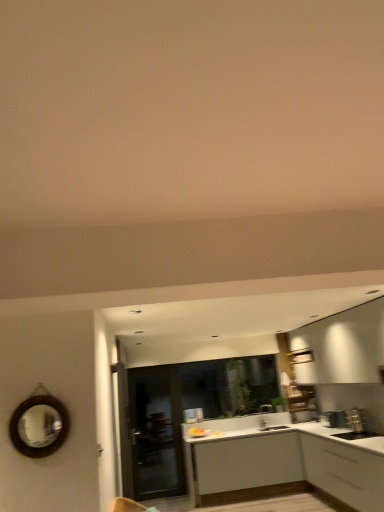
Question: Is silver metallic faucet at center to the left of white matte cabinet at lower right, marked as the 1th cabinetry in a front-to-back arrangement, from the viewer's perspective?

Choices:
 (A) no
 (B) yes

Answer: (B)

Question: Is silver metallic faucet at center in front of white matte cabinet at lower right, the 2th cabinetry positioned from the back?

Choices:
 (A) no
 (B) yes

Answer: (A)

Question: Considering the relative positions of silver metallic faucet at center and white matte cabinet at lower right, marked as the 1th cabinetry in a front-to-back arrangement, in the image provided, is silver metallic faucet at center to the right of white matte cabinet at lower right, marked as the 1th cabinetry in a front-to-back arrangement, from the viewer's perspective?

Choices:
 (A) yes
 (B) no

Answer: (B)

Question: Is silver metallic faucet at center turned away from white matte cabinet at lower right, the 2th cabinetry positioned from the back?

Choices:
 (A) no
 (B) yes

Answer: (A)

Question: Does silver metallic faucet at center have a larger size compared to white matte cabinet at lower right, the 2th cabinetry positioned from the back?

Choices:
 (A) no
 (B) yes

Answer: (A)

Question: Based on their sizes in the image, would you say transparent glass door at center is bigger or smaller than white matte cabinet at center, marked as the second cabinetry in a front-to-back arrangement?

Choices:
 (A) small
 (B) big

Answer: (A)

Question: From a real-world perspective, is transparent glass door at center positioned above or below white matte cabinet at center, the first cabinetry when ordered from back to front?

Choices:
 (A) below
 (B) above

Answer: (B)

Question: Is point (165, 472) positioned closer to the camera than point (291, 458)?

Choices:
 (A) farther
 (B) closer

Answer: (A)

Question: Considering their positions, is transparent glass door at center located in front of or behind white matte cabinet at center, marked as the second cabinetry in a front-to-back arrangement?

Choices:
 (A) behind
 (B) front

Answer: (A)

Question: Which is correct: brown wooden mirror at left is inside matte black door at center, or outside of it?

Choices:
 (A) outside
 (B) inside

Answer: (A)

Question: Visually, is brown wooden mirror at left positioned to the left or to the right of matte black door at center?

Choices:
 (A) right
 (B) left

Answer: (B)

Question: From a real-world perspective, is brown wooden mirror at left physically located above or below matte black door at center?

Choices:
 (A) above
 (B) below

Answer: (A)

Question: From the image's perspective, relative to matte black door at center, is brown wooden mirror at left above or below?

Choices:
 (A) below
 (B) above

Answer: (B)

Question: Is white matte cabinet at lower right, marked as the 1th cabinetry in a front-to-back arrangement, taller or shorter than white matte cabinet at center, marked as the second cabinetry in a front-to-back arrangement?

Choices:
 (A) tall
 (B) short

Answer: (B)

Question: From a real-world perspective, relative to white matte cabinet at center, the first cabinetry when ordered from back to front, is white matte cabinet at lower right, the 2th cabinetry positioned from the back, vertically above or below?

Choices:
 (A) below
 (B) above

Answer: (A)